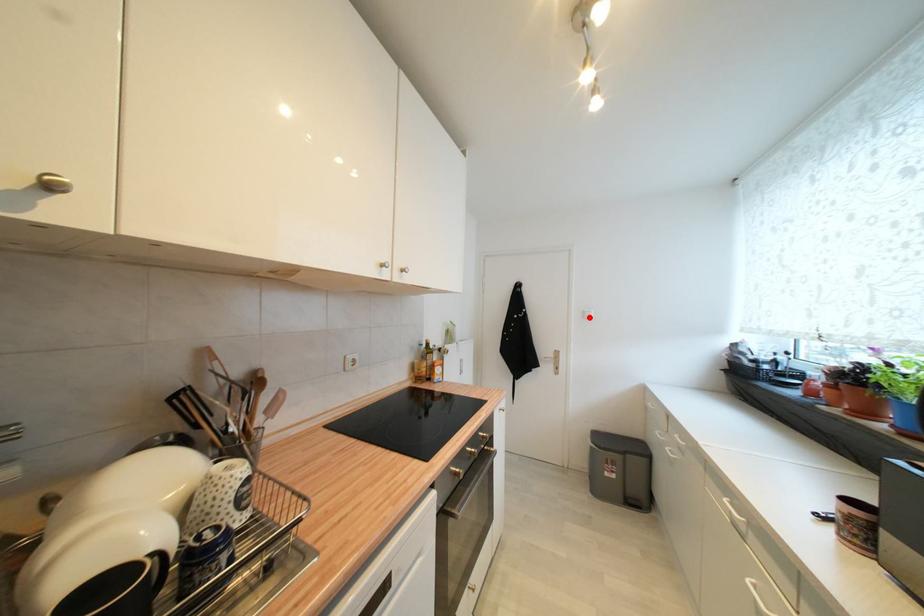
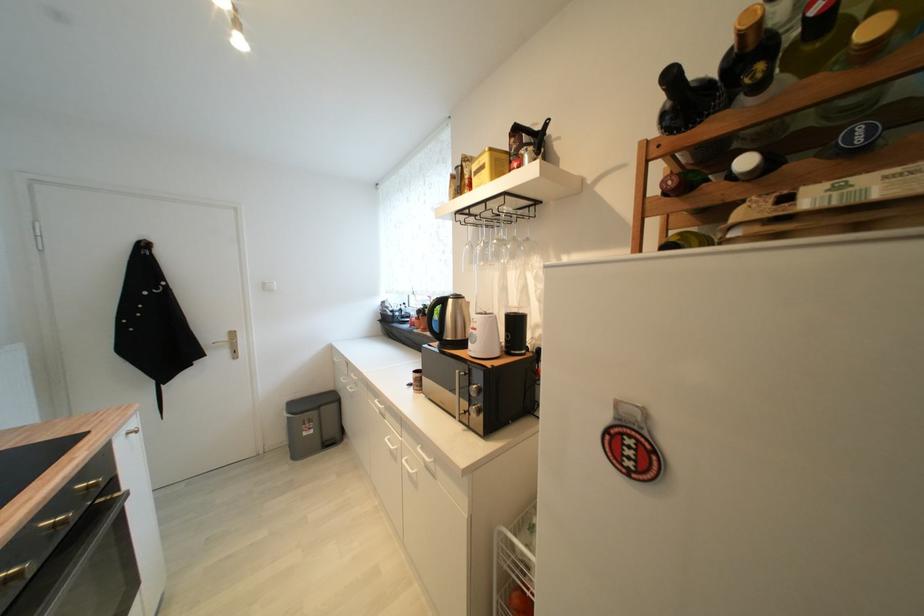
Locate, in the second image, the point that corresponds to the highlighted location in the first image.

(271, 289)